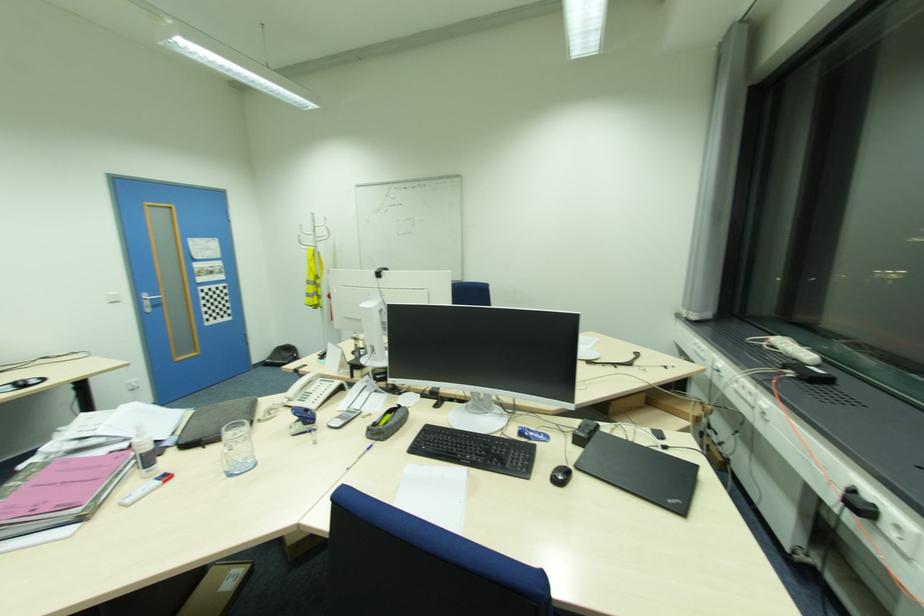
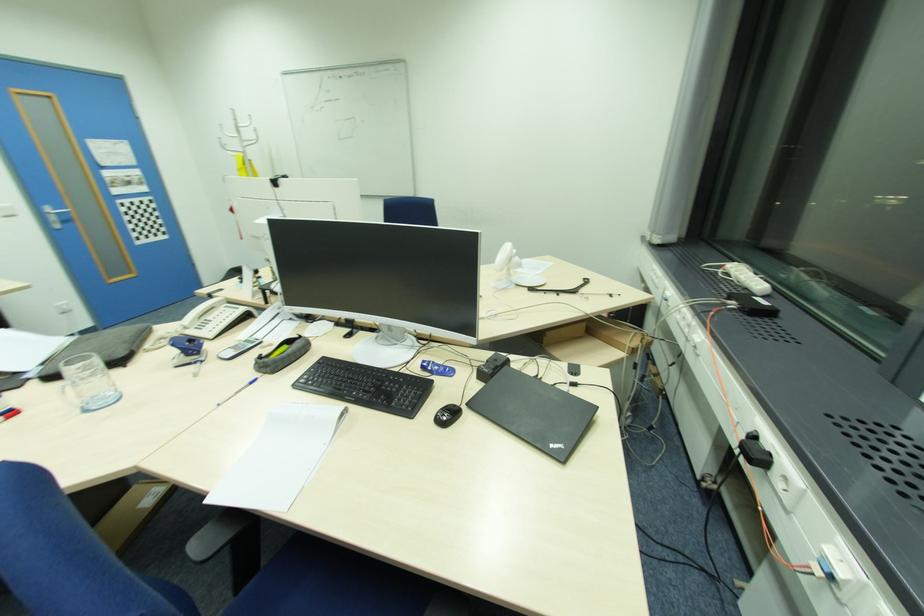
Locate, in the second image, the point that corresponds to pixel 470 475 in the first image.

(345, 415)